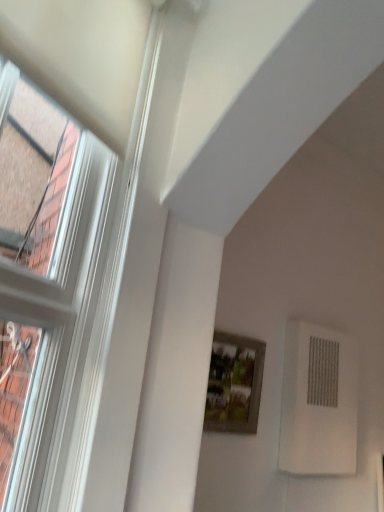
Question: From the image's perspective, is white textured air conditioning unit at lower right on wooden framed picture at center?

Choices:
 (A) no
 (B) yes

Answer: (A)

Question: Considering the relative sizes of white textured air conditioning unit at lower right and wooden framed picture at center in the image provided, is white textured air conditioning unit at lower right shorter than wooden framed picture at center?

Choices:
 (A) yes
 (B) no

Answer: (B)

Question: Is the position of white textured air conditioning unit at lower right more distant than that of wooden framed picture at center?

Choices:
 (A) yes
 (B) no

Answer: (A)

Question: Would you say white textured air conditioning unit at lower right is outside wooden framed picture at center?

Choices:
 (A) yes
 (B) no

Answer: (A)

Question: Is white textured air conditioning unit at lower right next to wooden framed picture at center?

Choices:
 (A) no
 (B) yes

Answer: (A)

Question: Is the depth of white textured air conditioning unit at lower right less than that of wooden framed picture at center?

Choices:
 (A) no
 (B) yes

Answer: (A)

Question: Does wooden framed picture at center have a lesser height compared to white textured air conditioning unit at lower right?

Choices:
 (A) no
 (B) yes

Answer: (B)

Question: Is wooden framed picture at center facing towards white textured air conditioning unit at lower right?

Choices:
 (A) no
 (B) yes

Answer: (A)

Question: Can you confirm if wooden framed picture at center is bigger than white textured air conditioning unit at lower right?

Choices:
 (A) yes
 (B) no

Answer: (B)

Question: Does wooden framed picture at center appear on the left side of white textured air conditioning unit at lower right?

Choices:
 (A) yes
 (B) no

Answer: (A)

Question: From a real-world perspective, is wooden framed picture at center under white textured air conditioning unit at lower right?

Choices:
 (A) no
 (B) yes

Answer: (B)

Question: Is wooden framed picture at center oriented away from white textured air conditioning unit at lower right?

Choices:
 (A) yes
 (B) no

Answer: (B)

Question: Looking at the image, does wooden framed picture at center seem bigger or smaller compared to white textured air conditioning unit at lower right?

Choices:
 (A) big
 (B) small

Answer: (B)